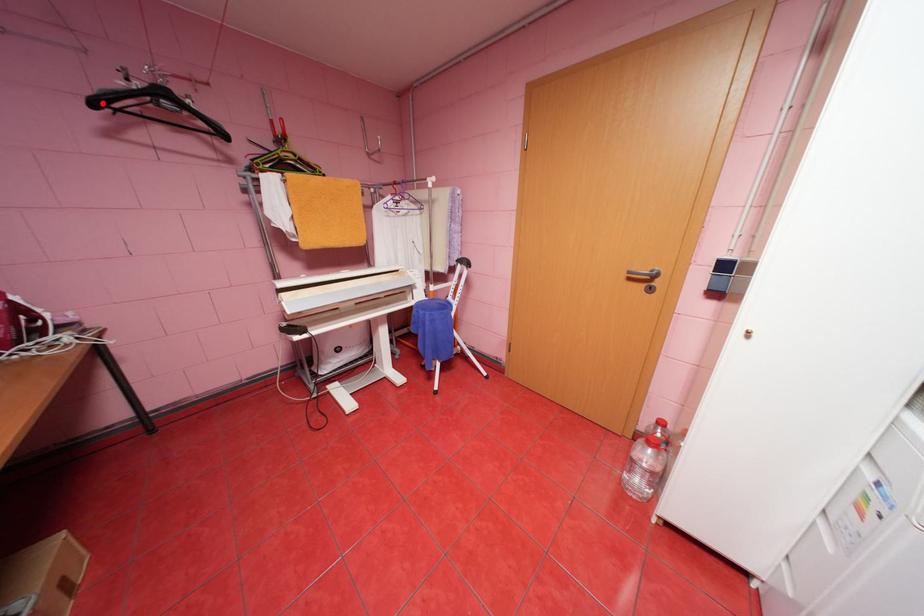
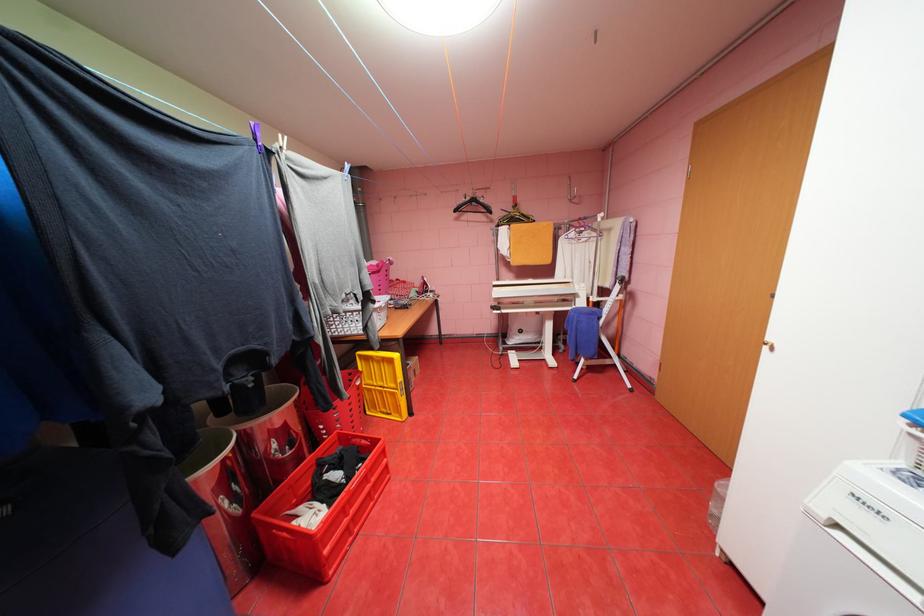
Question: A red point is marked in image1. In image2, is the corresponding 3D point closer to the camera or farther? Reply with the corresponding letter.

Choices:
 (A) The corresponding 3D point is closer.
 (B) The corresponding 3D point is farther.

Answer: (A)